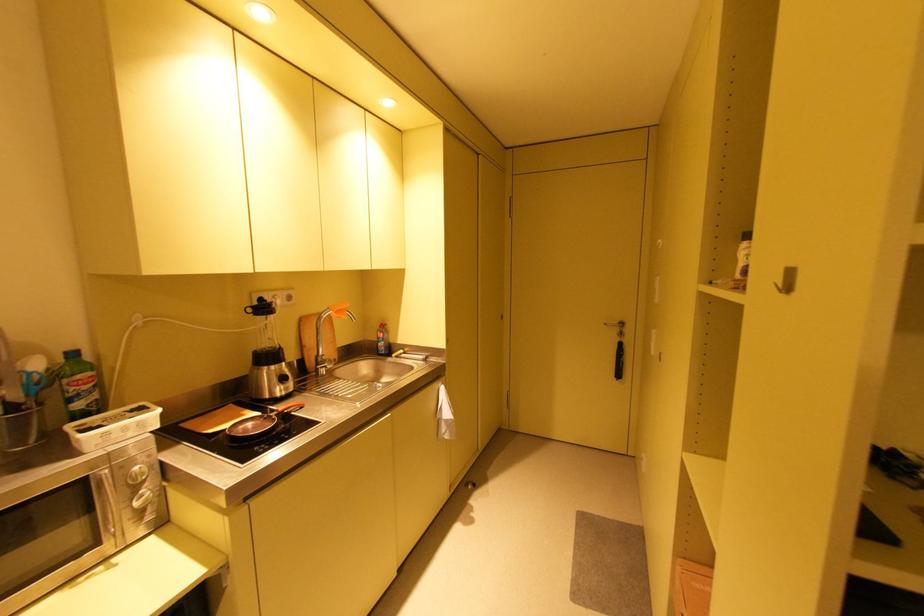
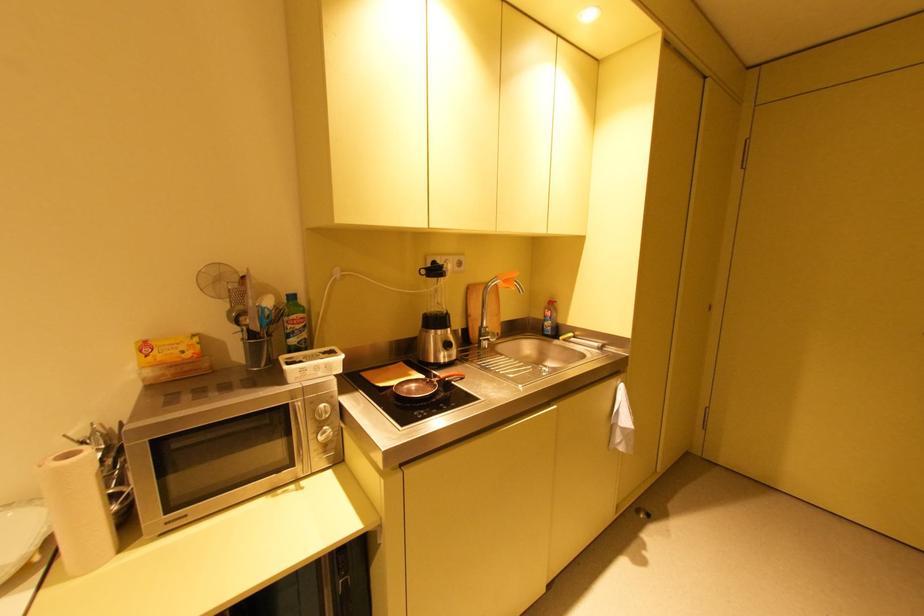
Where in the second image is the point corresponding to pixel 146 492 from the first image?

(330, 428)